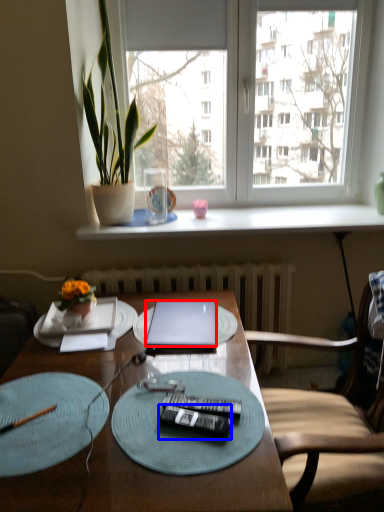
Question: Among these objects, which one is farthest to the camera, laptop (highlighted by a red box) or remote control (highlighted by a blue box)?

Choices:
 (A) laptop
 (B) remote control

Answer: (A)